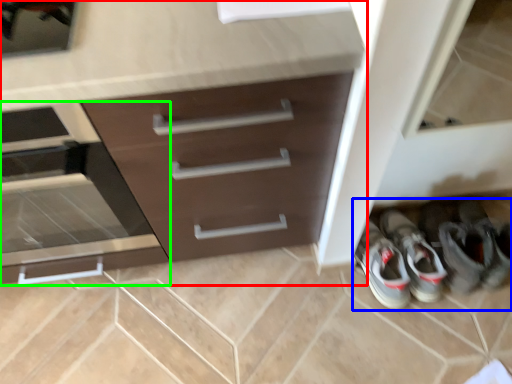
Question: Which object is positioned closest to chest of drawers (highlighted by a red box)? Select from footwear (highlighted by a blue box) and drawer (highlighted by a green box).

Choices:
 (A) footwear
 (B) drawer

Answer: (B)